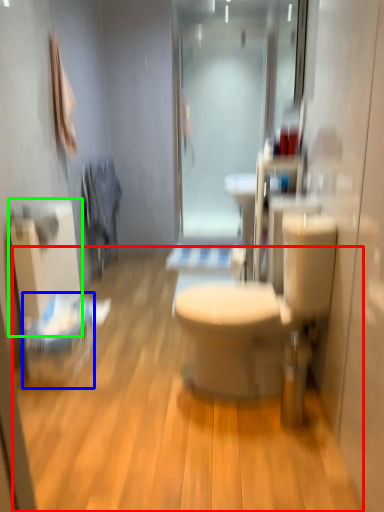
Question: Estimate the real-world distances between objects in this image. Which object is farther from plain (highlighted by a red box), laundry basket (highlighted by a blue box) or radiator (highlighted by a green box)?

Choices:
 (A) laundry basket
 (B) radiator

Answer: (B)